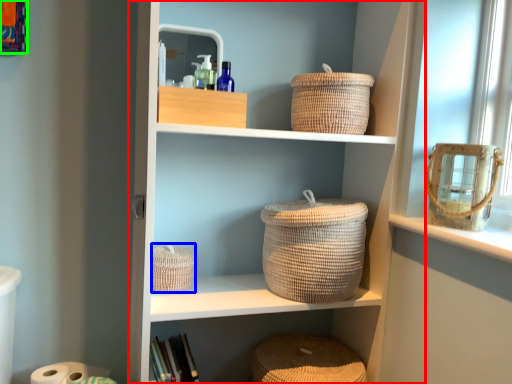
Question: Which is nearer to the shelf (highlighted by a red box)? basket (highlighted by a blue box) or picture frame (highlighted by a green box).

Choices:
 (A) basket
 (B) picture frame

Answer: (A)